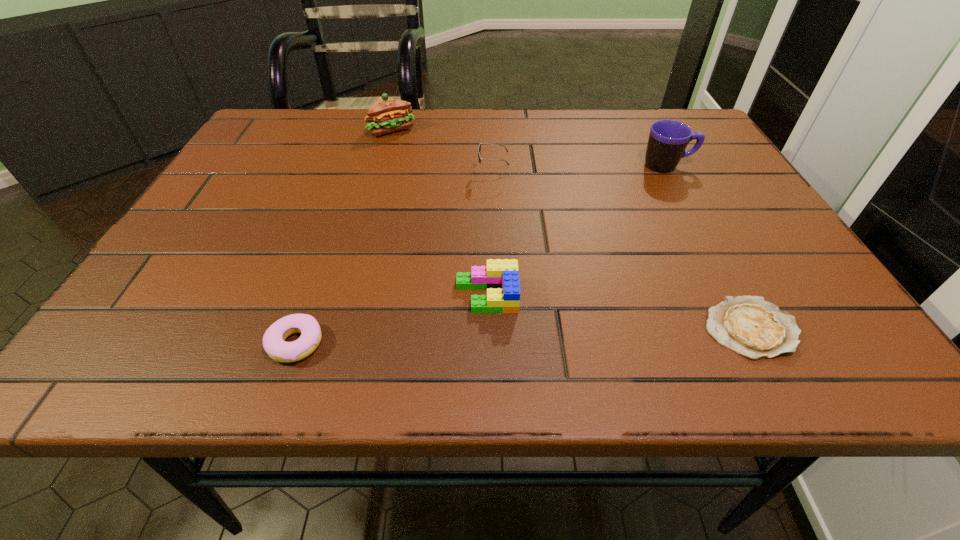
I want to click on blank region between the quiche and the farthest object, so click(x=571, y=229).

Identify the location of free space between the third shortest object and the third tallest object. The image size is (960, 540). pos(490,235).

You are a GUI agent. You are given a task and a screenshot of the screen. Output one action in this format:
    pyautogui.click(x=<x>, y=<y>)
    Task: Click on the blank region between the mug and the fifth tallest object
    
    Given the screenshot: What is the action you would take?
    pyautogui.click(x=482, y=255)

Identify the location of free space between the mug and the fourth shortest object. (580, 170).

Identify the location of unoccupied area between the doughnut and the Lego. This screenshot has height=540, width=960. (391, 320).

Where is `empty space that is in between the Lego and the mug`? The height and width of the screenshot is (540, 960). empty space that is in between the Lego and the mug is located at coordinates (577, 231).

Select which object appears as the closest to the fifth tallest object. Please provide its 2D coordinates. Your answer should be formatted as a tuple, i.e. [(x, y)], where the tuple contains the x and y coordinates of a point satisfying the conditions above.

[(500, 278)]

Find the location of `the fourth closest object to the fourth tallest object`. the fourth closest object to the fourth tallest object is located at coordinates pyautogui.click(x=668, y=139).

This screenshot has width=960, height=540. In order to click on vacant area in the image that satisfies the following two spatial constraints: 1. in front of the lenses of the fourth shortest object; 2. on the left side of the quiche in this screenshot , I will do `click(498, 328)`.

This screenshot has height=540, width=960. What are the coordinates of `vacant space that satisfies the following two spatial constraints: 1. on the front side of the sandwich; 2. on the left side of the fourth tallest object` in the screenshot? It's located at (346, 295).